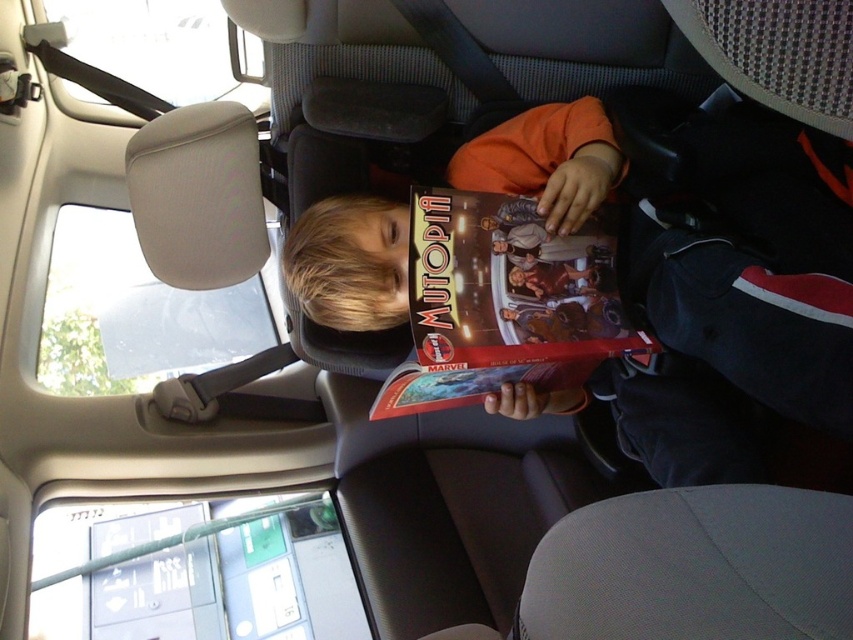
Does matte orange book at center appear under matte paper comic book at center?

Incorrect, matte orange book at center is not positioned below matte paper comic book at center.

Is matte orange book at center bigger than matte paper comic book at center?

Yes.

I want to click on matte orange book at center, so click(738, 298).